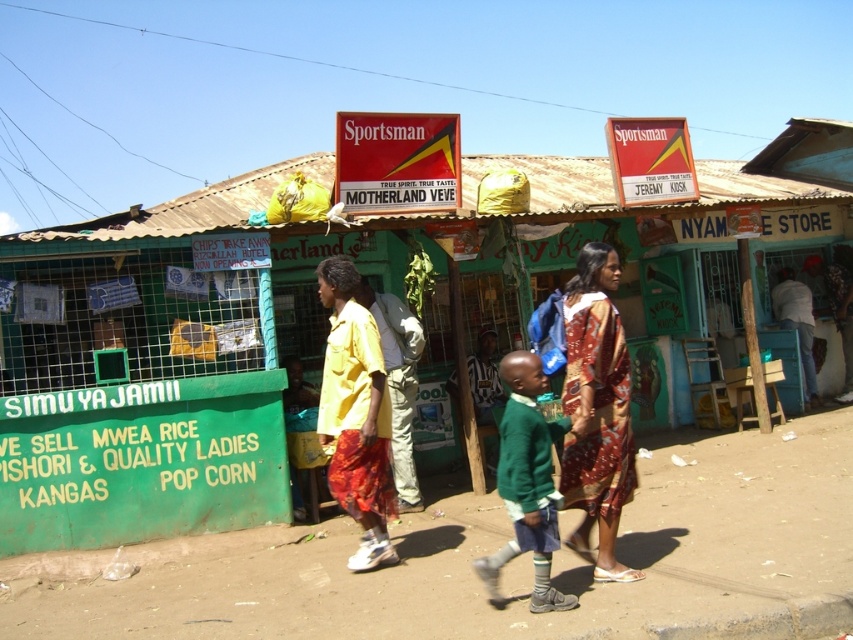
Can you confirm if printed silk dress at center is bigger than green knitted sweater at center?

No.

Between printed silk dress at center and green knitted sweater at center, which one has more height?

With more height is printed silk dress at center.

Where is `printed silk dress at center`? This screenshot has height=640, width=853. printed silk dress at center is located at coordinates (596, 412).

Which is behind, point (349, 371) or point (550, 515)?

Positioned behind is point (349, 371).

Which is in front, point (334, 435) or point (509, 426)?

Point (509, 426) is more forward.

Find the location of a particular element. yellow fabric skirt at center is located at coordinates (355, 413).

Measure the distance between printed silk dress at center and yellow fabric skirt at center.

printed silk dress at center and yellow fabric skirt at center are 4.53 feet apart from each other.

Which of these two, printed silk dress at center or yellow fabric skirt at center, stands shorter?

printed silk dress at center

This screenshot has height=640, width=853. Describe the element at coordinates (596, 412) in the screenshot. I see `printed silk dress at center` at that location.

You are a GUI agent. You are given a task and a screenshot of the screen. Output one action in this format:
    pyautogui.click(x=<x>, y=<y>)
    Task: Click on the printed silk dress at center
    This screenshot has width=853, height=640.
    Given the screenshot: What is the action you would take?
    pyautogui.click(x=596, y=412)